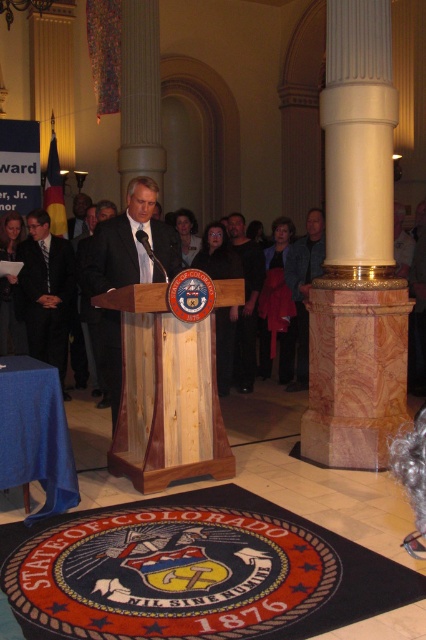
Question: From the image, what is the correct spatial relationship of matte black suit at center in relation to dark blue shirt at center?

Choices:
 (A) right
 (B) left

Answer: (B)

Question: Which of the following is the farthest from the observer?

Choices:
 (A) black cotton shirt at center
 (B) matte black suit at center
 (C) dark gray suit at center

Answer: (A)

Question: Among these points, which one is nearest to the camera?

Choices:
 (A) pos(367,122)
 (B) pos(256,248)

Answer: (A)

Question: Among these objects, which one is nearest to the camera?

Choices:
 (A) dark blue shirt at center
 (B) dark gray suit at center
 (C) natural wood podium at center
 (D) matte black suit at center

Answer: (C)

Question: Does matte black suit at center have a greater width compared to dark blue shirt at center?

Choices:
 (A) yes
 (B) no

Answer: (A)

Question: Can you confirm if white marble column at center is positioned below black cotton shirt at center?

Choices:
 (A) yes
 (B) no

Answer: (B)